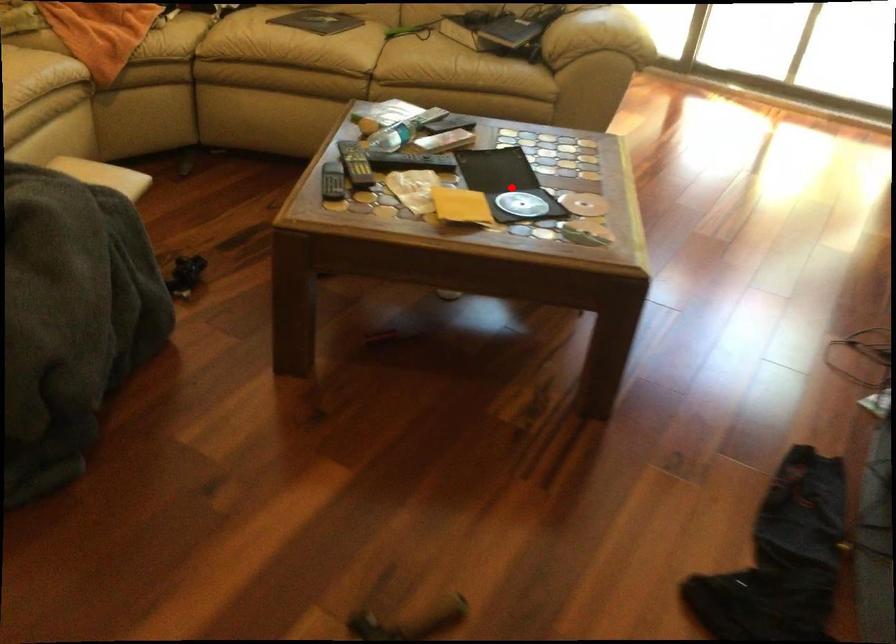
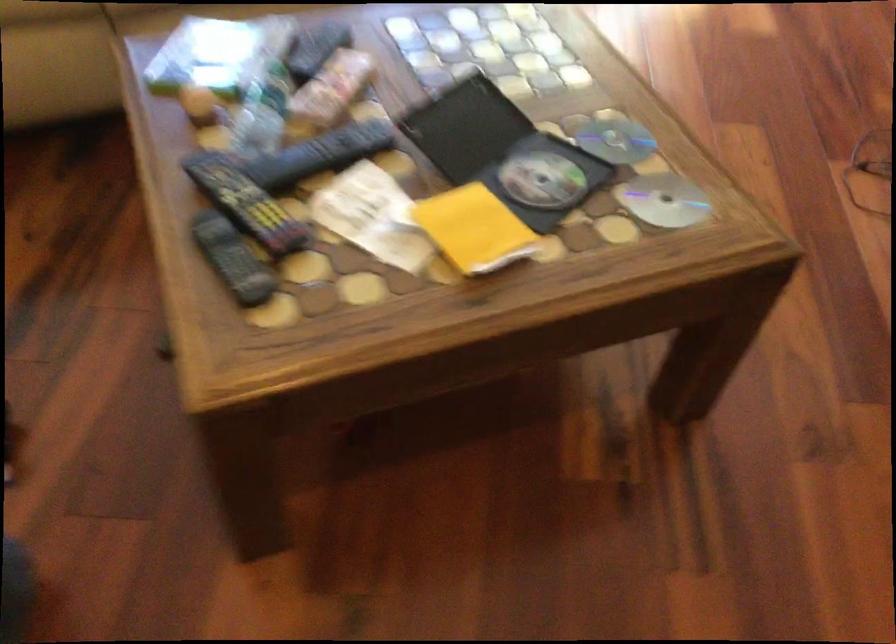
The point at the highlighted location is marked in the first image. Where is the corresponding point in the second image?

(503, 152)